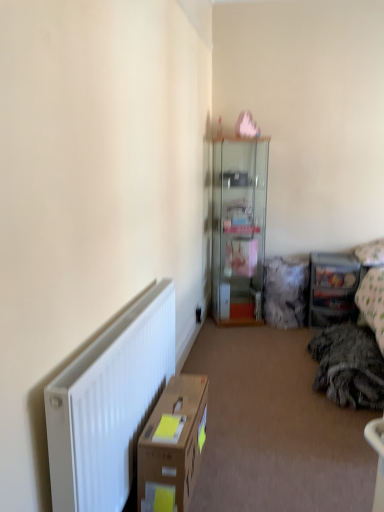
Identify the location of free location to the right of brown cardboard box at lower left. Image resolution: width=384 pixels, height=512 pixels. (246, 471).